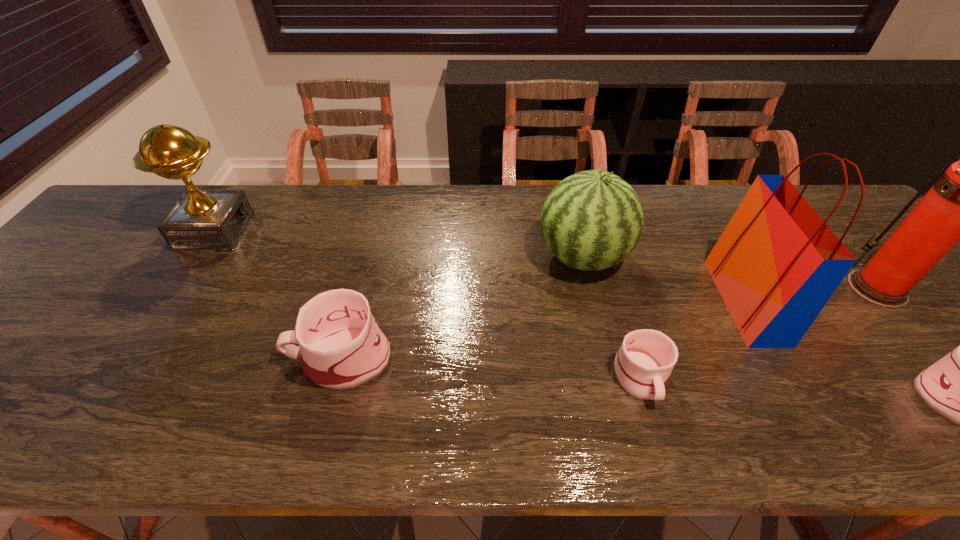
Identify the location of mug that is the closest to the leftmost object. The image size is (960, 540). (341, 347).

Select which mug appears as the second closest to the sixth tallest object. Please provide its 2D coordinates. Your answer should be formatted as a tuple, i.e. [(x, y)], where the tuple contains the x and y coordinates of a point satisfying the conditions above.

[(341, 347)]

Locate an element on the screen. free location that satisfies the following two spatial constraints: 1. on the handle side of the fifth object from left to right; 2. on the side with the handle of the second mug from right to left is located at coordinates tap(787, 377).

Find the location of a particular element. The height and width of the screenshot is (540, 960). free location that satisfies the following two spatial constraints: 1. on the handle side of the shopping bag; 2. on the side with the handle of the second mug from left to right is located at coordinates 787,377.